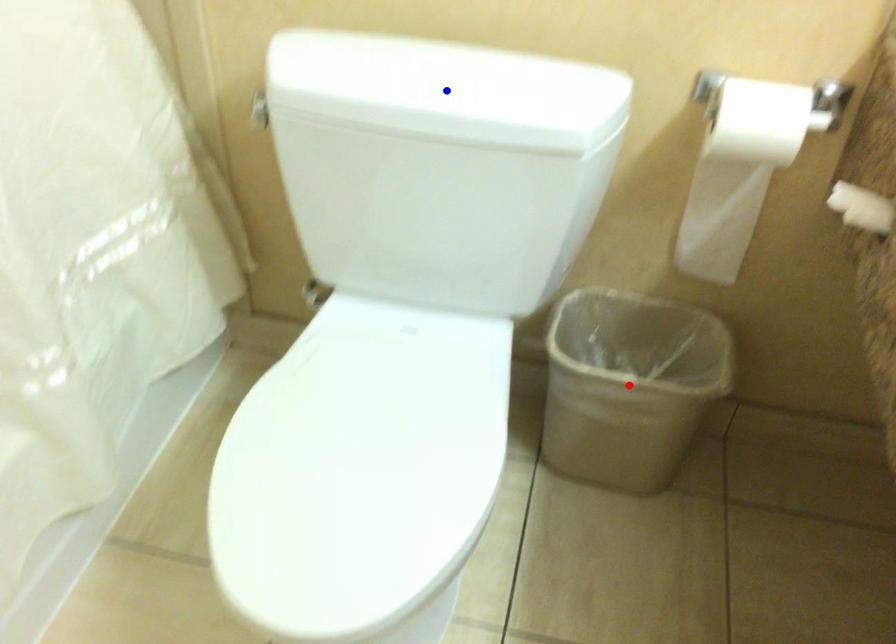
Question: Two points are marked on the image. Which point is closer to the camera?

Choices:
 (A) Blue point is closer.
 (B) Red point is closer.

Answer: (A)